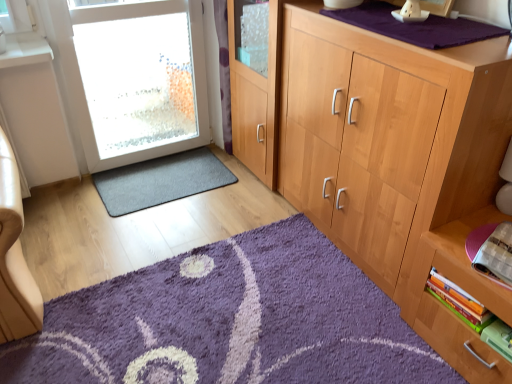
The height and width of the screenshot is (384, 512). I want to click on free space above light wood cabinet at center right (from a real-world perspective), so click(x=394, y=19).